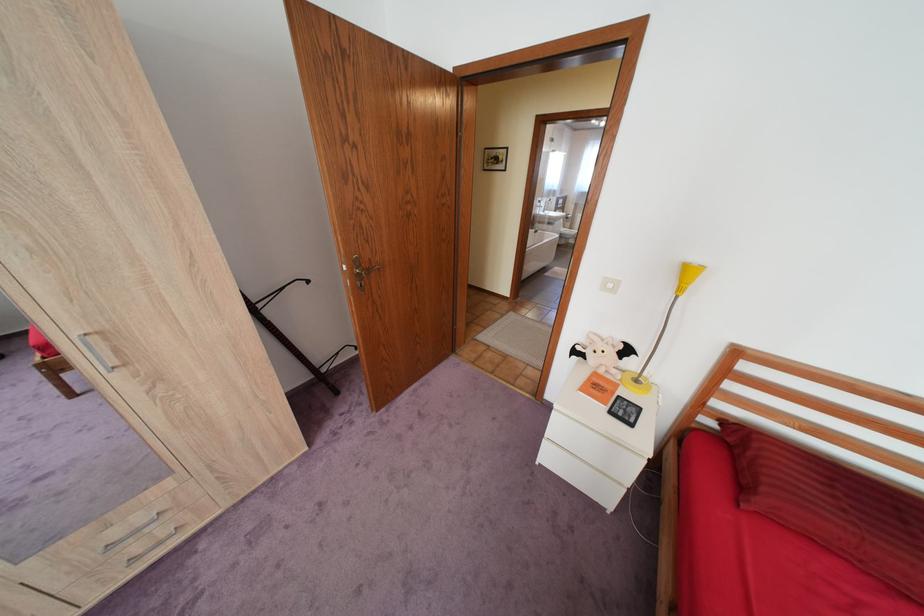
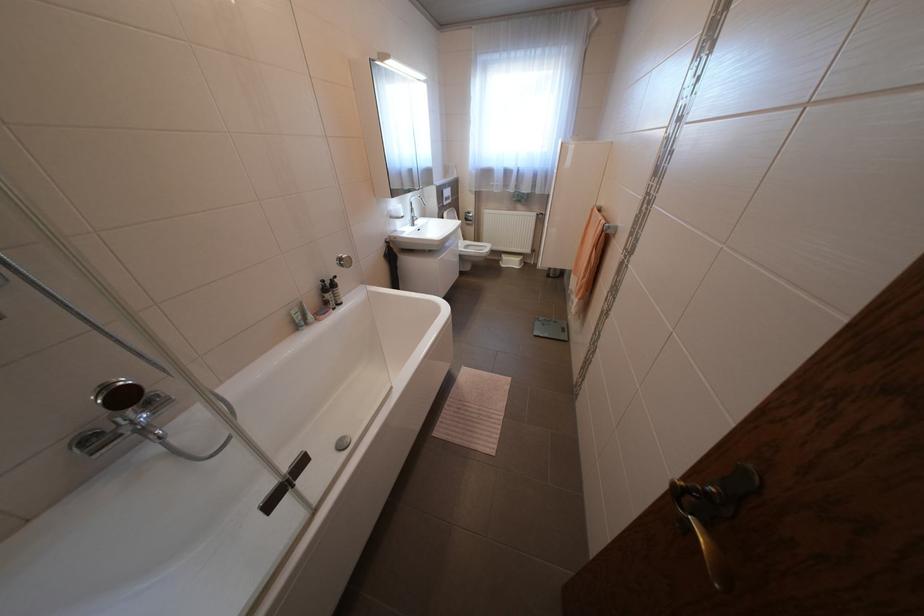
Looking at this image, in a continuous first-person perspective shot, in which direction is the camera moving?

The cameraman moved toward right, forward.